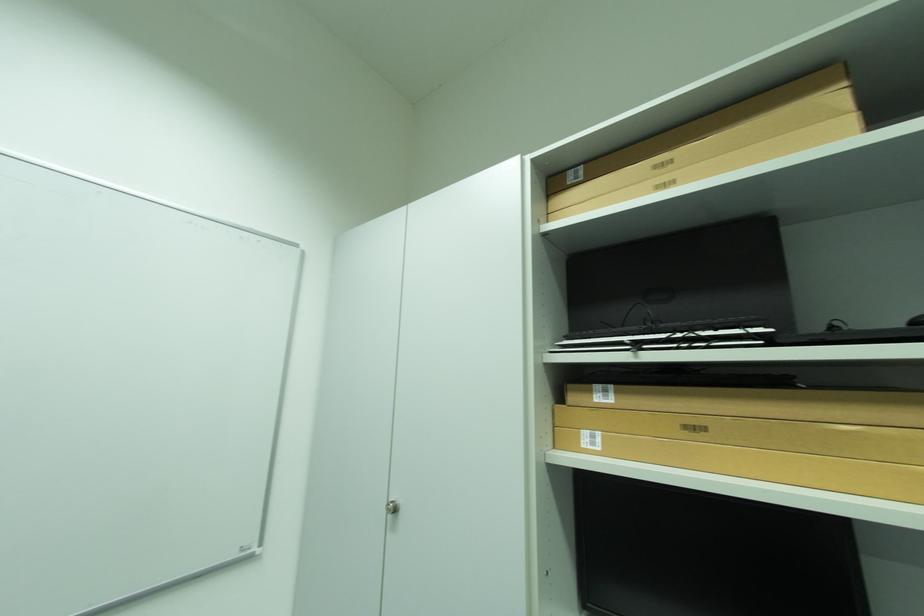
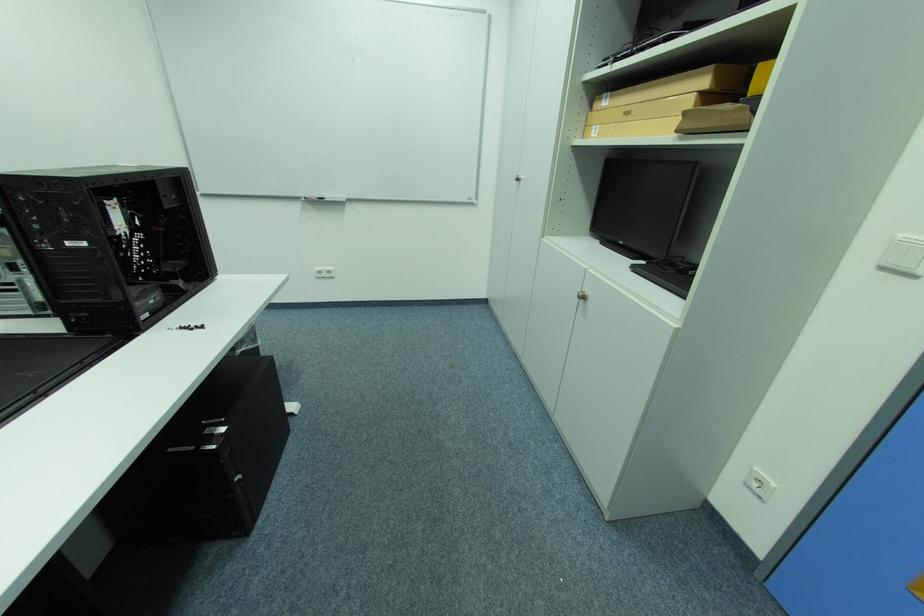
In the second image, find the point that corresponds to pixel 614 392 in the first image.

(614, 98)